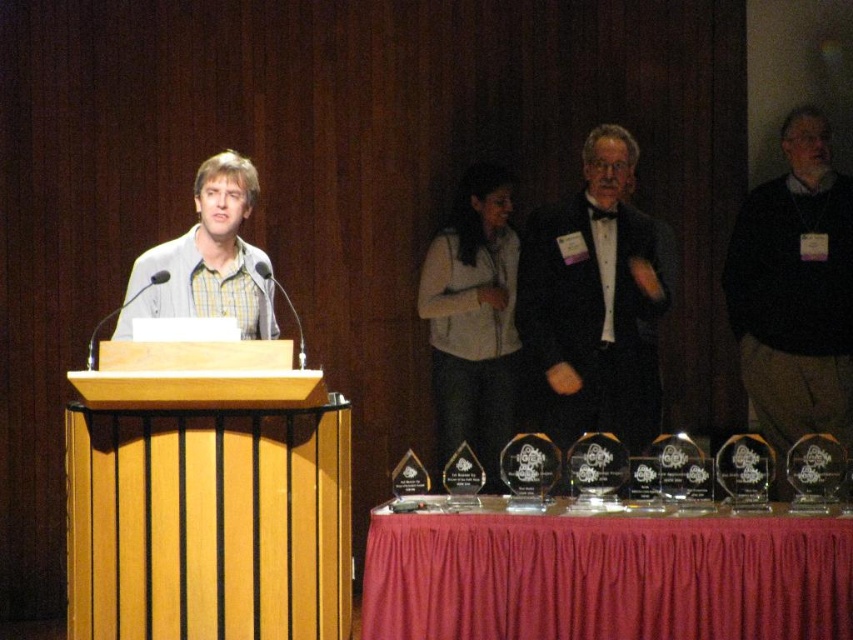
You are an event photographer positioned behind the podium. You need to capture a photo of both the black satin tuxedo at center and the black sweater at right. Which one will appear closer to the camera in the photo?

The black satin tuxedo at center will appear closer to the camera in the photo because it is further to the viewer than the black sweater at right, meaning it is positioned nearer to your camera location.

You are organizing a coat rack for the attendees at the event. You have two items to hang on the rack. The black sweater at right and the white fleece vest at center. Which item requires a larger hanger?

The black sweater at right requires a larger hanger because it has a larger size compared to the white fleece vest at center.